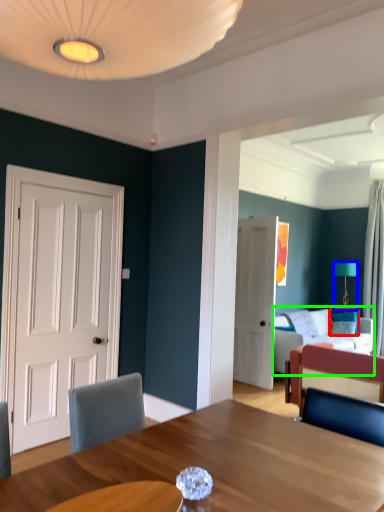
Question: Based on their relative distances, which object is nearer to pillow (highlighted by a red box)? Choose from lamp (highlighted by a blue box) and studio couch (highlighted by a green box).

Choices:
 (A) lamp
 (B) studio couch

Answer: (B)